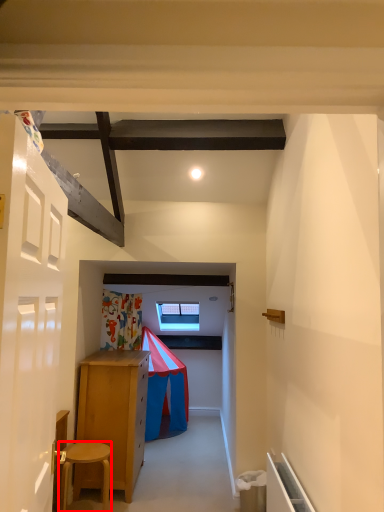
Question: In this image, where is stool (annotated by the red box) located relative to door?

Choices:
 (A) right
 (B) left

Answer: (B)